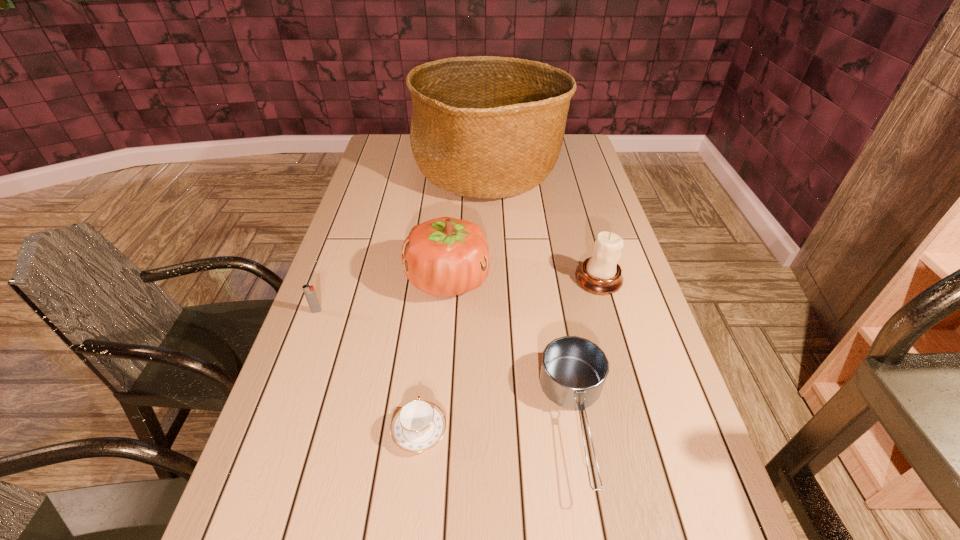
Where is `the tallest object`? the tallest object is located at coordinates (481, 127).

The height and width of the screenshot is (540, 960). What are the coordinates of `the farthest object` in the screenshot? It's located at (481, 127).

This screenshot has width=960, height=540. I want to click on pumpkin, so click(x=445, y=256).

Locate an element on the screen. The height and width of the screenshot is (540, 960). the third tallest object is located at coordinates (600, 274).

Where is `the leftmost object`? This screenshot has width=960, height=540. the leftmost object is located at coordinates (310, 294).

Locate an element on the screen. This screenshot has height=540, width=960. saucepan is located at coordinates (573, 371).

Where is `the shortest object`? the shortest object is located at coordinates (419, 425).

Locate an element on the screen. The height and width of the screenshot is (540, 960). free space located on the front of the tallest object is located at coordinates (490, 244).

The image size is (960, 540). Find the location of `free space located on the side of the second tallest object with the cute face`. free space located on the side of the second tallest object with the cute face is located at coordinates (549, 280).

Identify the location of free space located on the front of the fourth shortest object. (639, 422).